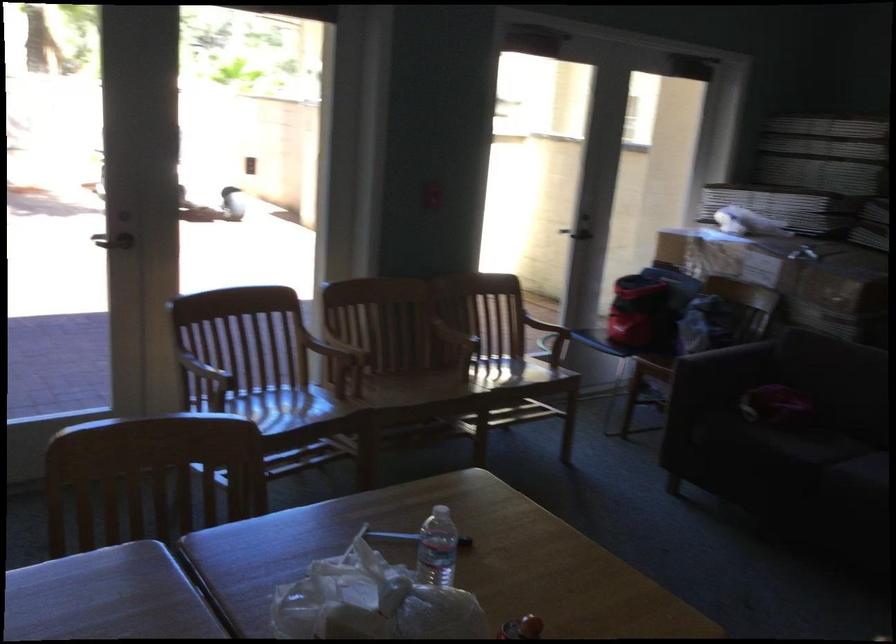
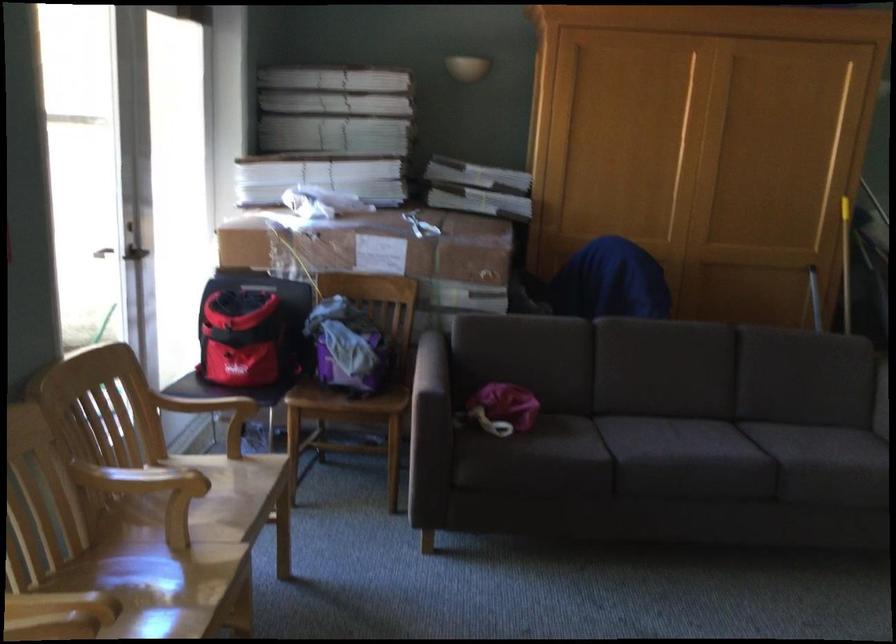
Find the pixel in the second image that matches pixel 581 234 in the first image.

(132, 272)